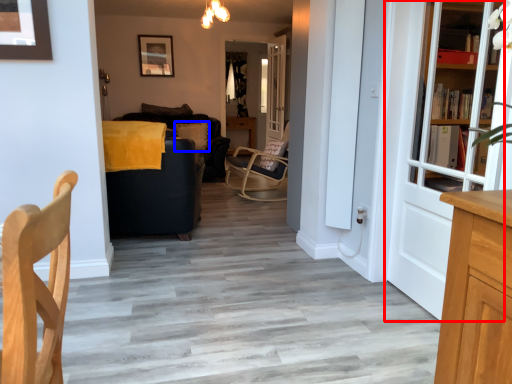
Question: Which object is further to the camera taking this photo, door (highlighted by a red box) or pillow (highlighted by a blue box)?

Choices:
 (A) door
 (B) pillow

Answer: (B)